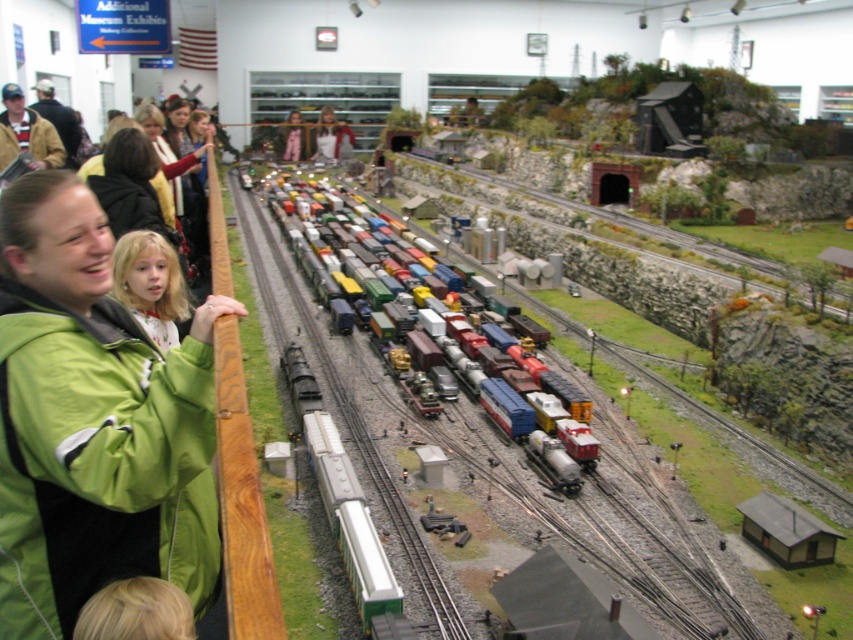
Question: Which point appears farthest from the camera in this image?

Choices:
 (A) (47, 147)
 (B) (532, 520)
 (C) (24, 529)
 (D) (135, 237)

Answer: (A)

Question: Which object is positioned closest to the brown leather jacket at upper left?

Choices:
 (A) matte pink sweater at center
 (B) metallic freight train at center

Answer: (B)

Question: Considering the real-world distances, which object is farthest from the metallic silver train track at center?

Choices:
 (A) matte pink shirt at upper center
 (B) metallic freight train at center

Answer: (A)

Question: Does metallic silver train track at center have a smaller size compared to metallic freight train at center?

Choices:
 (A) no
 (B) yes

Answer: (B)

Question: Is metallic freight train at center bigger than blonde hair at left?

Choices:
 (A) yes
 (B) no

Answer: (A)

Question: Is green fabric jacket at left positioned behind blonde hair at left?

Choices:
 (A) yes
 (B) no

Answer: (B)